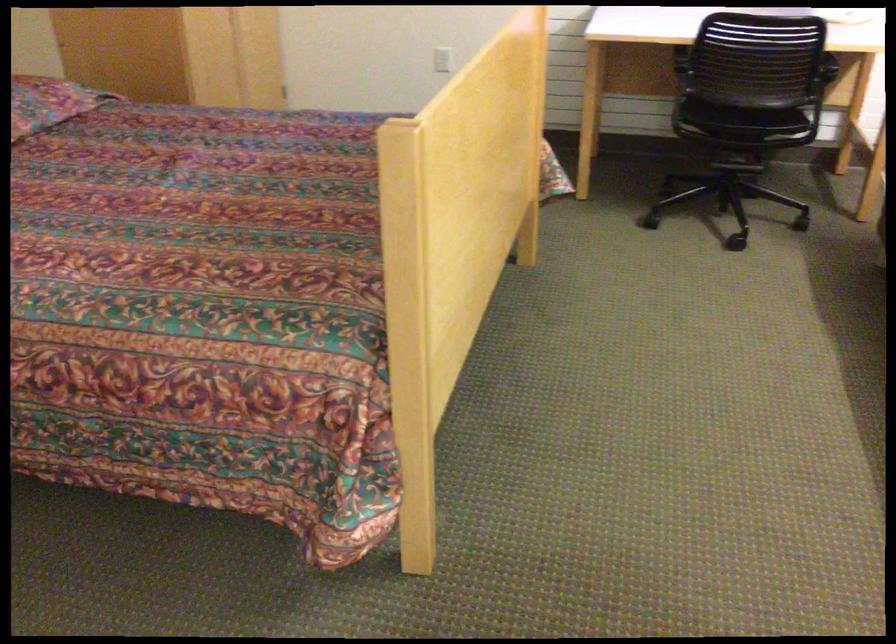
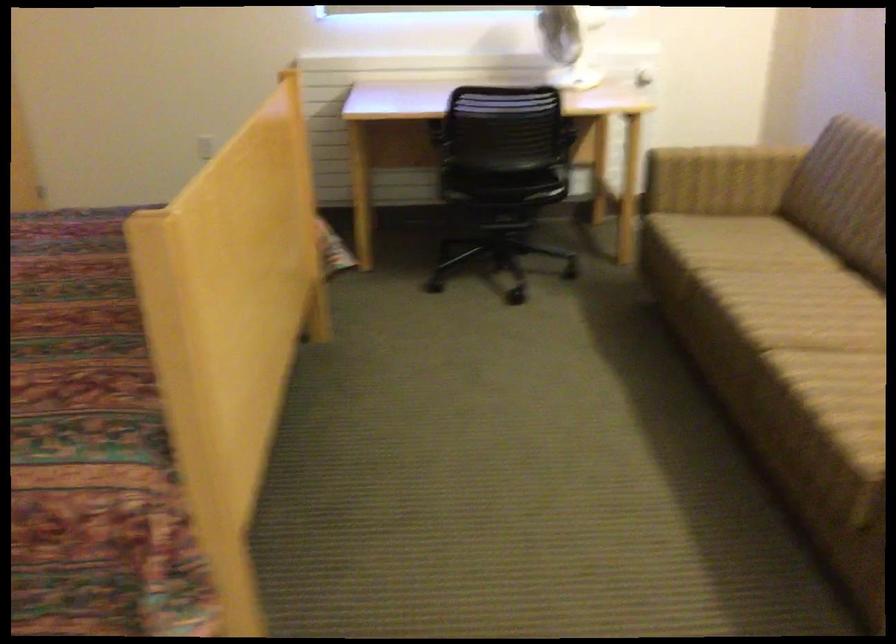
Question: In a continuous first-person perspective shot, in which direction is the camera moving?

Choices:
 (A) Left
 (B) Right
 (C) Forward
 (D) Backward

Answer: (B)